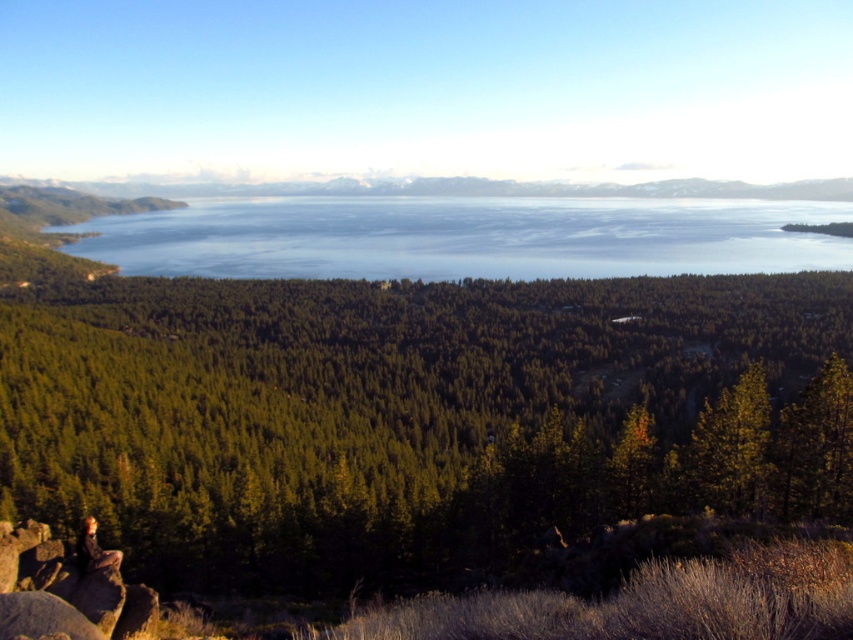
Question: Estimate the real-world distances between objects in this image. Which object is farther from the camouflage pants at lower left?

Choices:
 (A) blue water at center
 (B) green matte tree at center

Answer: (A)

Question: Based on their relative distances, which object is farther from the green matte tree at center?

Choices:
 (A) blue water at center
 (B) camouflage pants at lower left

Answer: (A)

Question: Is blue water at center wider than camouflage pants at lower left?

Choices:
 (A) no
 (B) yes

Answer: (B)

Question: Considering the relative positions of green matte tree at center and camouflage pants at lower left in the image provided, where is green matte tree at center located with respect to camouflage pants at lower left?

Choices:
 (A) left
 (B) right

Answer: (A)

Question: Which object appears closest to the camera in this image?

Choices:
 (A) camouflage pants at lower left
 (B) green matte tree at center

Answer: (A)

Question: Can you confirm if blue water at center is positioned above camouflage pants at lower left?

Choices:
 (A) no
 (B) yes

Answer: (B)